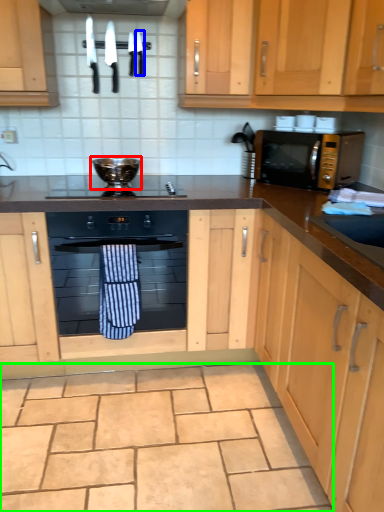
Question: Based on their relative distances, which object is farther from appliance (highlighted by a red box)? Choose from knife (highlighted by a blue box) and granite (highlighted by a green box).

Choices:
 (A) knife
 (B) granite

Answer: (B)